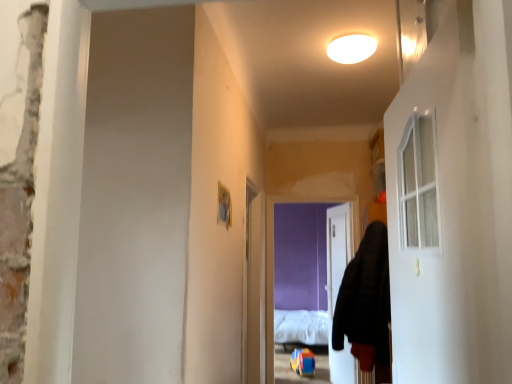
Question: From the image's perspective, is white fluffy bed at center located above or below clear plastic screen door at center?

Choices:
 (A) above
 (B) below

Answer: (B)

Question: From a real-world perspective, is white fluffy bed at center above or below clear plastic screen door at center?

Choices:
 (A) below
 (B) above

Answer: (A)

Question: Estimate the real-world distances between objects in this image. Which object is closer to the white glass door at right, which is the first door from front to back?

Choices:
 (A) white matte ceiling light at upper center
 (B) clear plastic screen door at center
 (C) white glossy door at center, which is counted as the second door, starting from the front
 (D) white fluffy bed at center
 (E) black fuzzy hoodie at right

Answer: (E)

Question: Based on their relative distances, which object is farther from the white glass door at right, which is the first door from front to back?

Choices:
 (A) white fluffy bed at center
 (B) black fuzzy hoodie at right
 (C) white glossy door at center, the 1th door positioned from the right
 (D) white matte ceiling light at upper center
 (E) clear plastic screen door at center

Answer: (A)